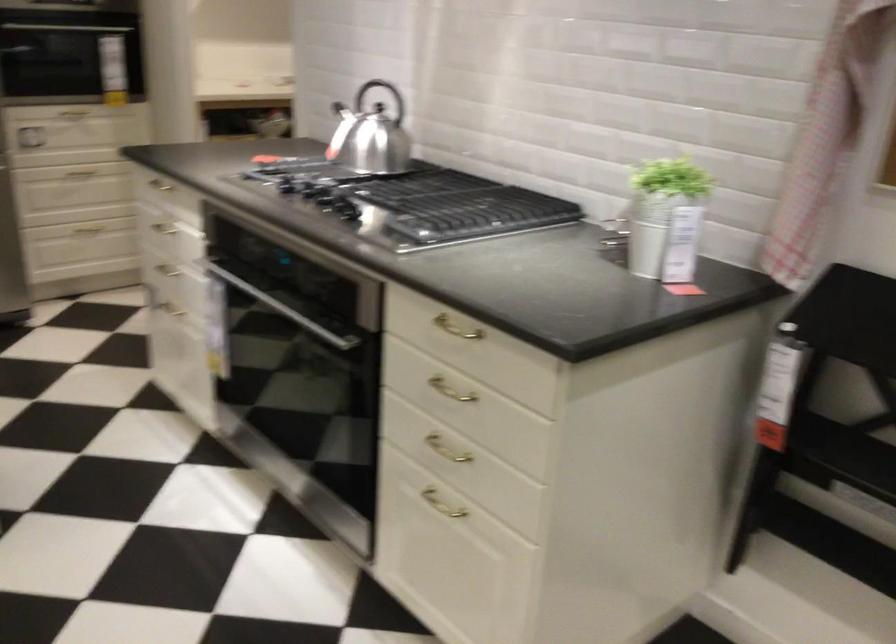
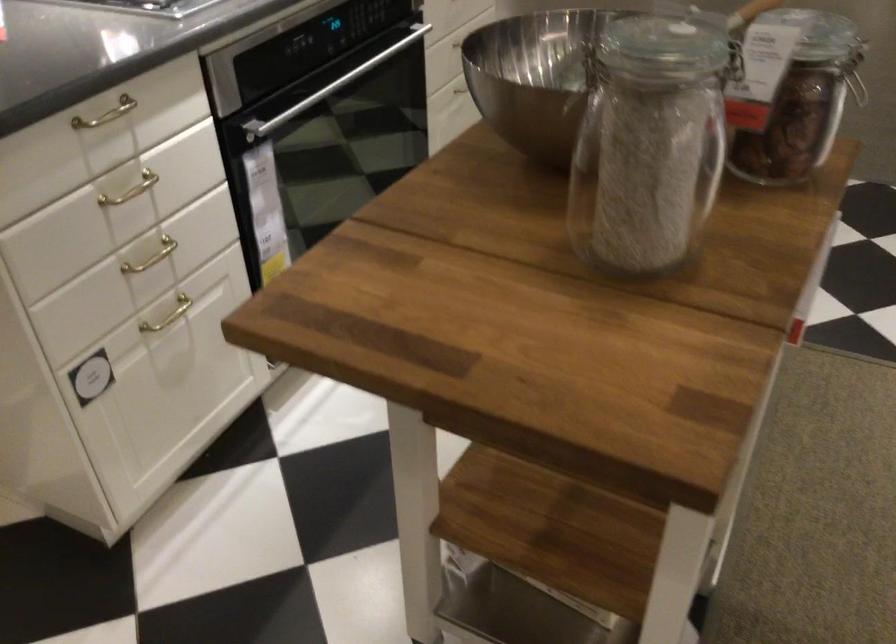
Find the pixel in the second image that matches point 169,181 in the first image.

(106, 114)